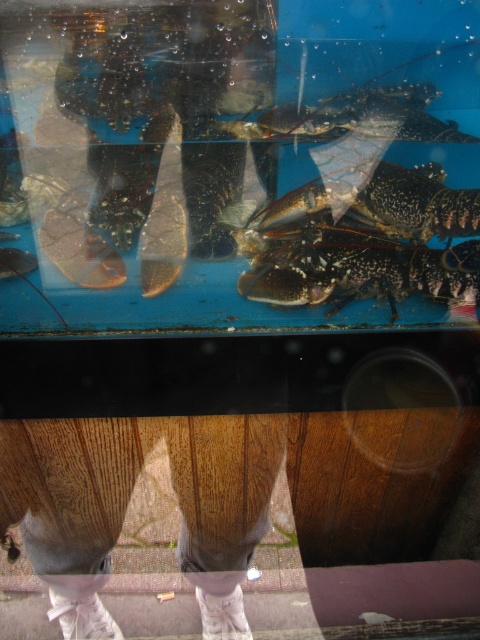
Looking at this image, you are a marine biologist observing the fish tank. You notice the speckled shell lobster at center and the shiny black lobster at upper center. Which lobster is positioned to the right of the other?

The speckled shell lobster at center is positioned to the right of the shiny black lobster at upper center.

You are looking at the fish tank and notice two points marked on the glass. The first point is at coordinate point (x=249, y=276) and the second is at point (x=360, y=88). Which point is closer to you?

Point (x=249, y=276) is closer to you because it is further to the viewer than point (x=360, y=88).

You are a marine biologist observing the fish tank. You need to identify which lobster is larger between the speckled shell lobster at center and the shiny black lobster at upper center. Which one is larger?

The speckled shell lobster at center is bigger than the shiny black lobster at upper center.